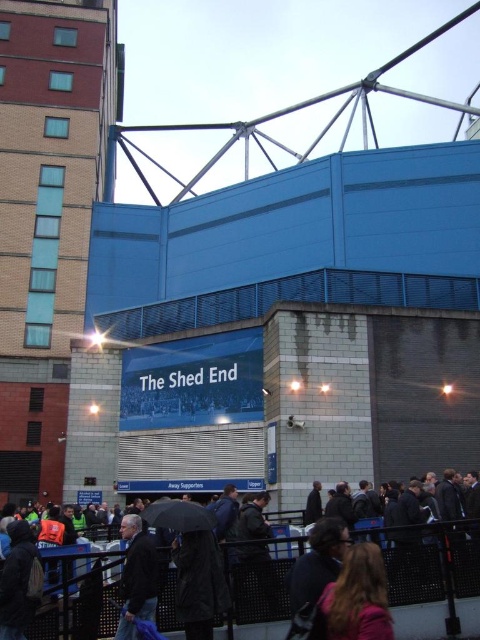
Question: Which object appears farthest from the camera in this image?

Choices:
 (A) black matte umbrella at lower center
 (B) dark blue jacket at lower left
 (C) blonde hair at lower center
 (D) dark gray jacket at lower center

Answer: (A)

Question: Which object appears closest to the camera in this image?

Choices:
 (A) black matte umbrella at lower center
 (B) blonde hair at lower center

Answer: (B)

Question: Among these points, which one is farthest from the camera?

Choices:
 (A) (334, 593)
 (B) (176, 516)

Answer: (B)

Question: Can you confirm if dark gray jacket at lower center is bigger than black matte umbrella at lower center?

Choices:
 (A) no
 (B) yes

Answer: (A)

Question: In this image, where is dark gray jacket at lower center located relative to blonde hair at lower center?

Choices:
 (A) above
 (B) below

Answer: (B)

Question: Where is dark gray jacket at lower center located in relation to black matte umbrella at lower center in the image?

Choices:
 (A) left
 (B) right

Answer: (B)